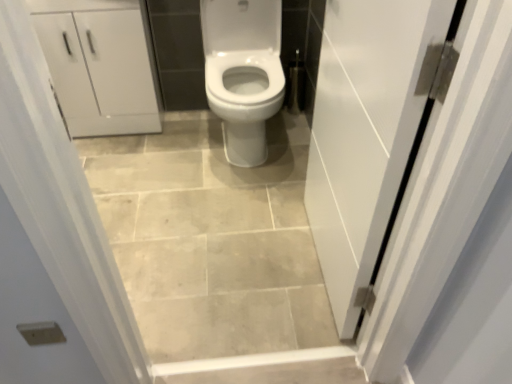
Question: Is point (312, 317) positioned closer to the camera than point (141, 96)?

Choices:
 (A) farther
 (B) closer

Answer: (B)

Question: Visually, is beige ceramic tile at center positioned to the left or to the right of white matte cabinet at upper left?

Choices:
 (A) left
 (B) right

Answer: (B)

Question: Estimate the real-world distances between objects in this image. Which object is farther from the white matte cabinet at upper left?

Choices:
 (A) white glossy door at right
 (B) beige ceramic tile at center

Answer: (A)

Question: Which of these objects is positioned closest to the white matte cabinet at upper left?

Choices:
 (A) white glossy door at right
 (B) beige ceramic tile at center

Answer: (B)